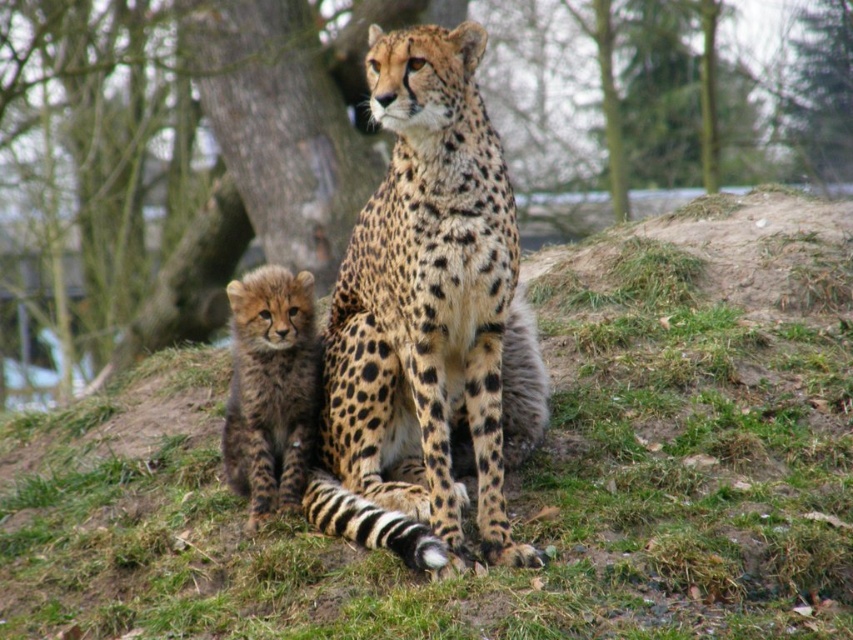
Who is shorter, spotted fur cheetah at center or spotted fur cub at lower left?

spotted fur cub at lower left is shorter.

Is point (495, 561) positioned before point (283, 332)?

Yes, it is.

I want to click on spotted fur cheetah at center, so click(x=421, y=314).

Which of these two, brown bark tree at center or spotted fur cub at lower left, stands taller?

brown bark tree at center

Who is positioned more to the right, brown bark tree at center or spotted fur cub at lower left?

From the viewer's perspective, brown bark tree at center appears more on the right side.

Is point (724, 77) positioned behind point (222, 438)?

That is True.

This screenshot has width=853, height=640. I want to click on brown bark tree at center, so click(241, 176).

Which is more to the left, fuzzy green grass at center or brown bark tree at center?

From the viewer's perspective, brown bark tree at center appears more on the left side.

Is point (827, 529) behind point (782, 65)?

No, it is in front of (782, 65).

Find the location of a particular element. The width and height of the screenshot is (853, 640). fuzzy green grass at center is located at coordinates pos(512,474).